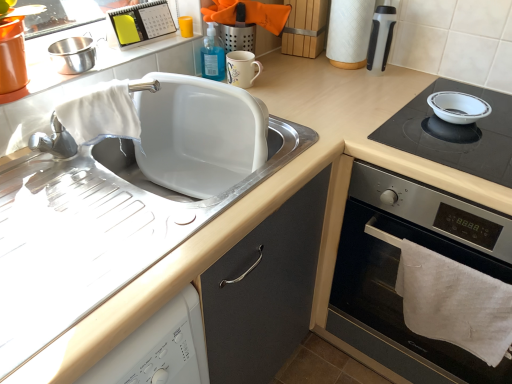
The height and width of the screenshot is (384, 512). Identify the location of vacant area that lies between matte ceramic mug at upper center, acting as the third appliance starting from the left, and matte black thermos at upper right, acting as the fourth appliance starting from the left. (309, 83).